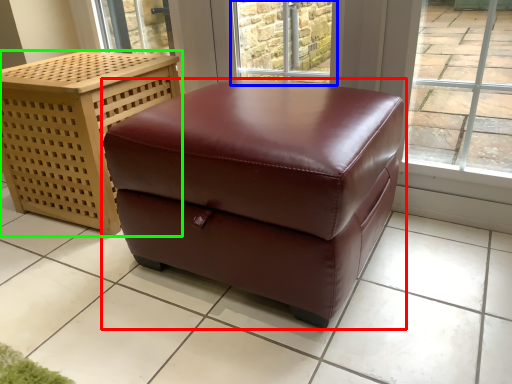
Question: Which object is positioned farthest from table (highlighted by a red box)? Select from window (highlighted by a blue box) and furniture (highlighted by a green box).

Choices:
 (A) window
 (B) furniture

Answer: (A)